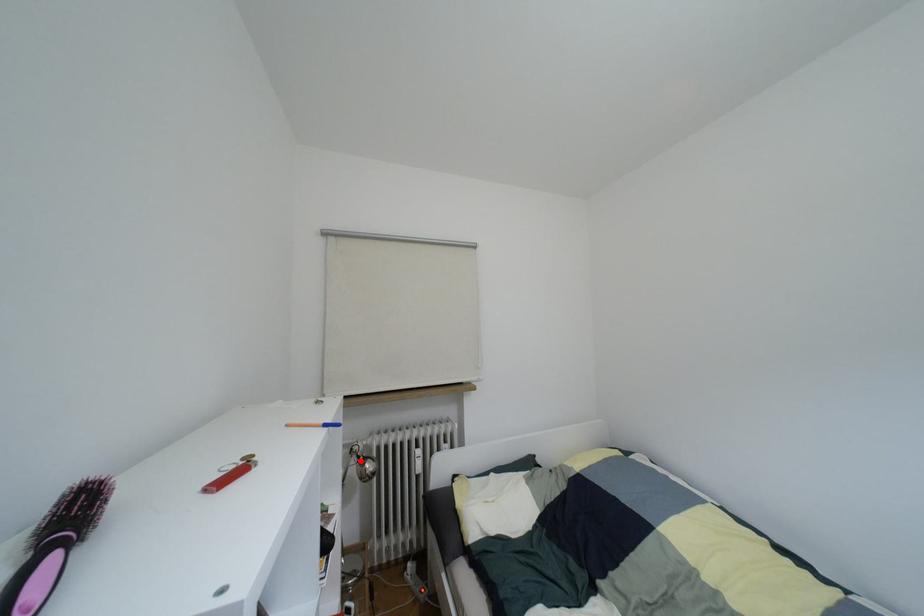
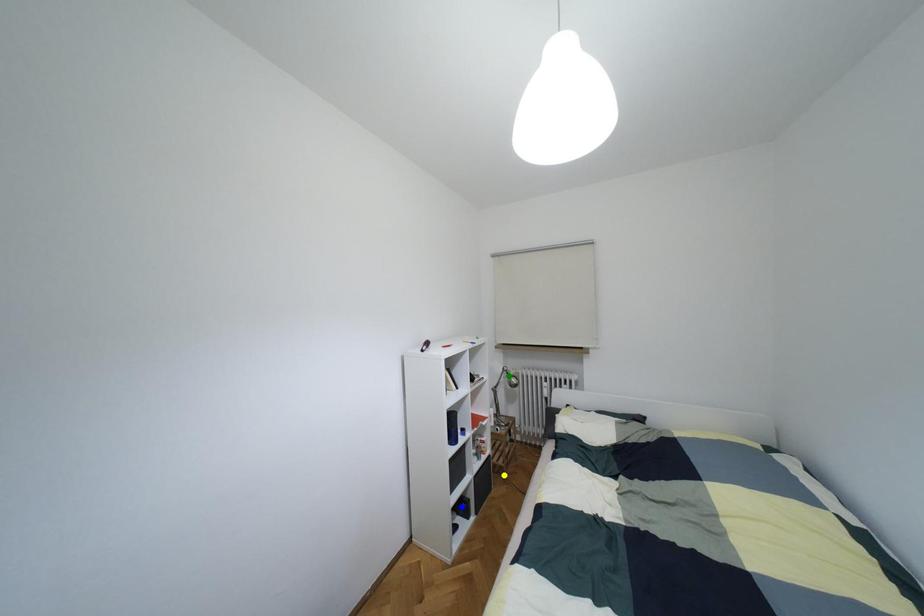
Question: I am providing you with two images of the same scene from different viewpoints. A red point is marked on the first image. You are given multiple points on the second image. Can you choose the point in image 2 that corresponds to the point in image 1?

Choices:
 (A) green point
 (B) yellow point
 (C) blue point

Answer: (A)